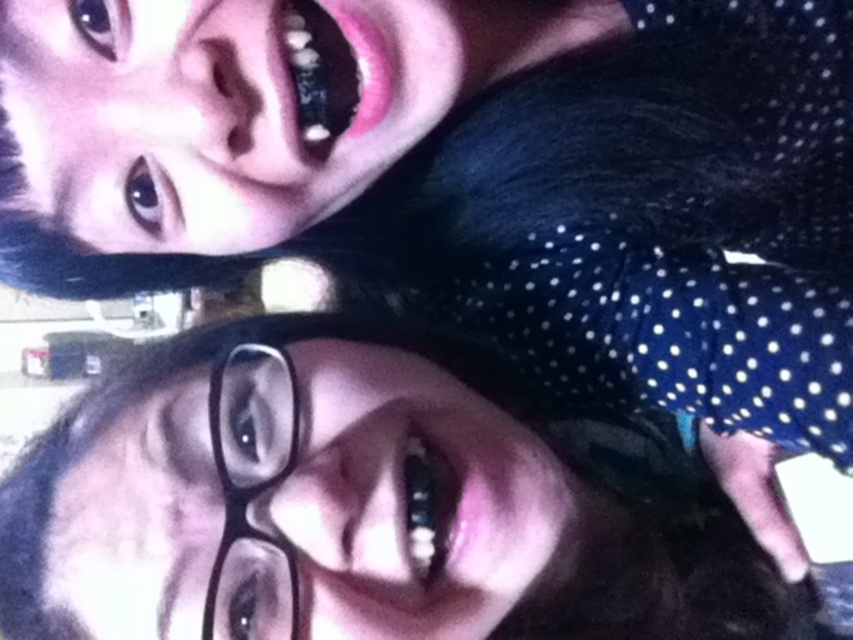
Question: Is black matte glasses at center to the right of black plastic glasses at lower left from the viewer's perspective?

Choices:
 (A) no
 (B) yes

Answer: (B)

Question: Is black matte glasses at center wider than black plastic glasses at lower left?

Choices:
 (A) yes
 (B) no

Answer: (A)

Question: Does black matte glasses at center appear over black plastic glasses at lower left?

Choices:
 (A) yes
 (B) no

Answer: (B)

Question: Which of the following is the farthest from the observer?

Choices:
 (A) black plastic glasses at lower left
 (B) black matte glasses at center

Answer: (A)